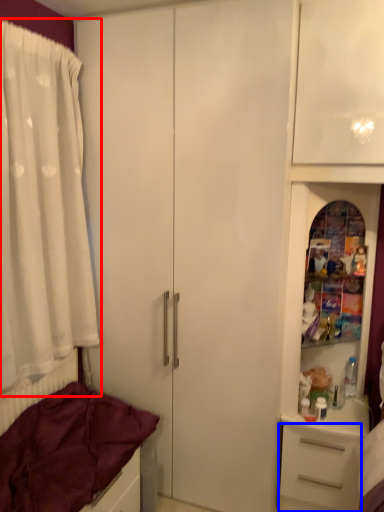
Question: Among these objects, which one is farthest to the camera, curtain (highlighted by a red box) or drawer (highlighted by a blue box)?

Choices:
 (A) curtain
 (B) drawer

Answer: (B)